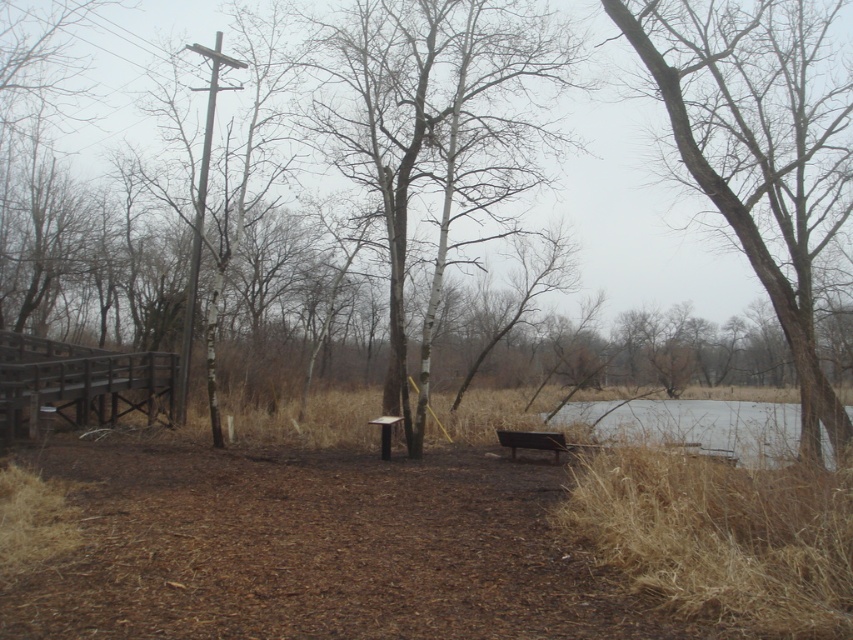
Which is in front, point (712, 444) or point (383, 451)?

Point (712, 444) is in front.

Measure the distance between clear water at lower right and camera.

7.38 meters

Is point (608, 406) farther from viewer compared to point (401, 419)?

Yes, it is.

Identify the location of clear water at lower right. This screenshot has height=640, width=853. tap(697, 426).

Can you confirm if bare wood tree at center is shorter than brown textured tree at right?

No, bare wood tree at center is not shorter than brown textured tree at right.

Between bare wood tree at center and brown textured tree at right, which one is positioned higher?

bare wood tree at center

The image size is (853, 640). I want to click on bare wood tree at center, so click(x=434, y=131).

Is bare wood tree at center bigger than brown wooden bench at center?

Indeed, bare wood tree at center has a larger size compared to brown wooden bench at center.

Can you confirm if bare wood tree at center is shorter than brown wooden bench at center?

No.

You are a GUI agent. You are given a task and a screenshot of the screen. Output one action in this format:
    pyautogui.click(x=<x>, y=<y>)
    Task: Click on the bare wood tree at center
    The height and width of the screenshot is (640, 853).
    Given the screenshot: What is the action you would take?
    pyautogui.click(x=434, y=131)

Find the location of `bare wood tree at center`. bare wood tree at center is located at coordinates (434, 131).